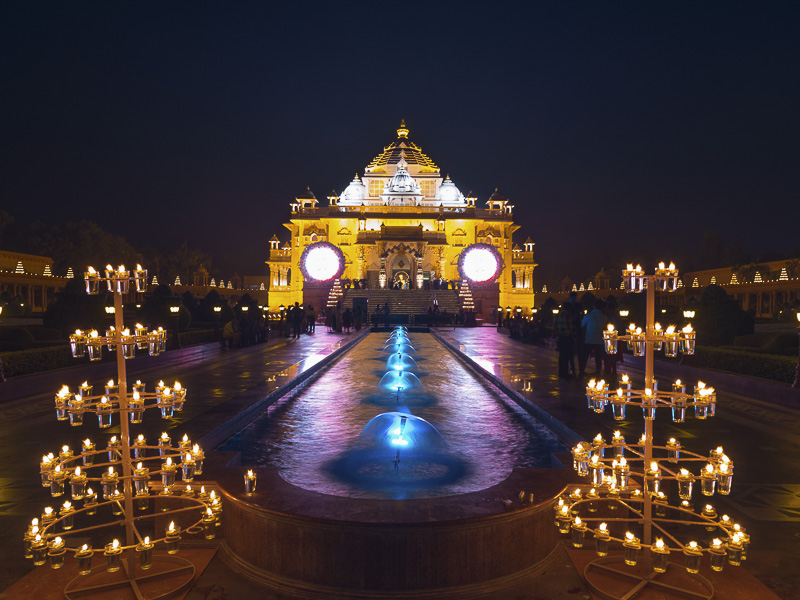
Where is `slightly red square tile`? slightly red square tile is located at coordinates (36, 590), (742, 591).